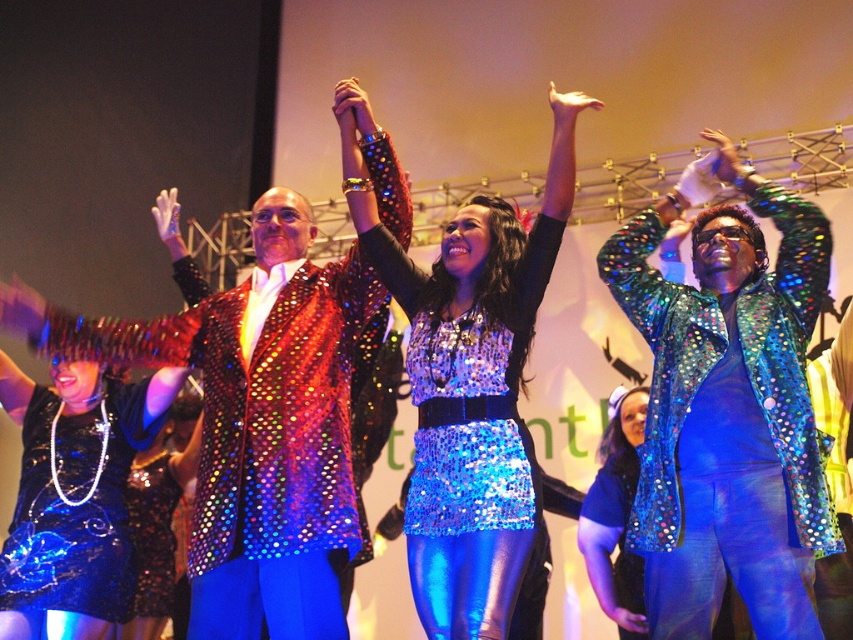
You are a stagehand who needs to adjust the lighting for the holographic sequin jacket at upper right and the shiny sequined jacket at center. The lighting system can only cover a maximum distance of 3.8 feet between objects. Can you adjust the lighting for both jackets without moving the lights?

The distance between the holographic sequin jacket at upper right and the shiny sequined jacket at center is 3.90 feet, which exceeds the lighting system maximum coverage of 3.8 feet. Therefore, you cannot adjust the lighting for both jackets without moving the lights.

Consider the image. You are a photographer standing at the front of the stage. You want to take a photo that includes both point (233, 317) and point (627, 602). Which point will appear larger in your photo?

Point (233, 317) is closer to the camera than point (627, 602), so it will appear larger in the photo.

You are a stagehand standing at the center of the stage. You need to retrieve the holographic sequin jacket at upper right. Which direction should you move to reach it?

The holographic sequin jacket at upper right is located at point 0.642 on the x axis and 0.855 on the y axis. Since you are at the center, you should move to the right and forward to reach it.